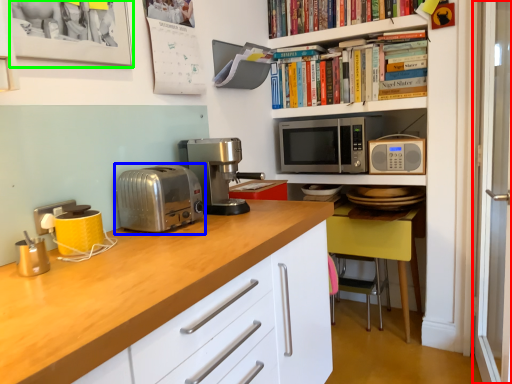
Question: Which is farther away from glass door (highlighted by a red box)? toaster (highlighted by a blue box) or picture frame (highlighted by a green box)?

Choices:
 (A) toaster
 (B) picture frame

Answer: (B)